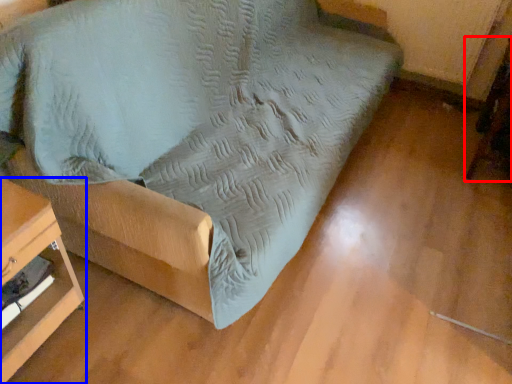
Question: Which object appears farthest to the camera in this image, swivel chair (highlighted by a red box) or furniture (highlighted by a blue box)?

Choices:
 (A) swivel chair
 (B) furniture

Answer: (A)